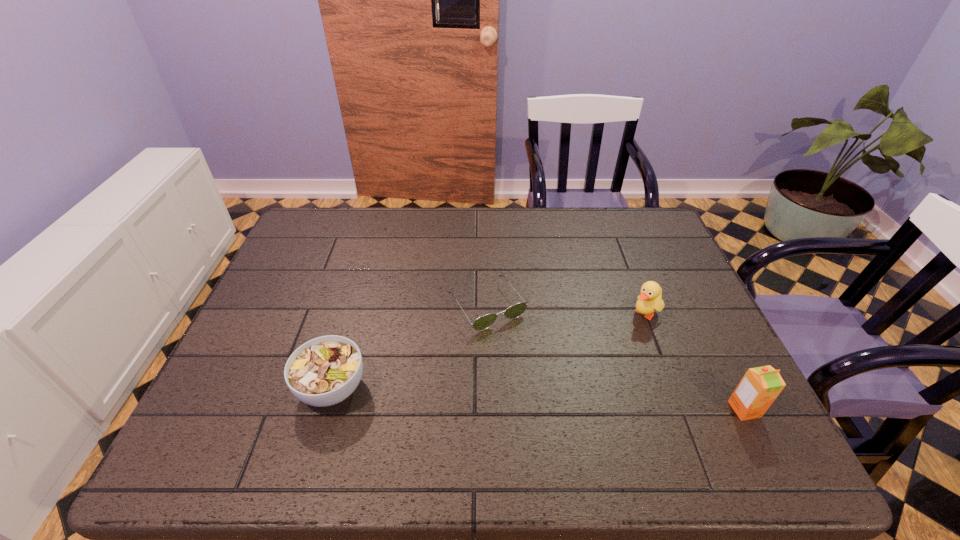
Locate an element on the screen. The width and height of the screenshot is (960, 540). soup bowl is located at coordinates (324, 371).

Locate an element on the screen. the leftmost object is located at coordinates (324, 371).

The image size is (960, 540). I want to click on orange juice, so click(760, 386).

Image resolution: width=960 pixels, height=540 pixels. Find the location of `the tallest object`. the tallest object is located at coordinates (760, 386).

At what (x,y) coordinates should I click in order to perform the action: click on duckling. Please return your answer as a coordinate pair (x, y). This screenshot has height=540, width=960. Looking at the image, I should click on (650, 299).

This screenshot has height=540, width=960. What are the coordinates of `the second tallest object` in the screenshot? It's located at (650, 299).

The height and width of the screenshot is (540, 960). I want to click on the shortest object, so click(484, 322).

Locate an element on the screen. sunglasses is located at coordinates point(484,322).

The image size is (960, 540). Find the location of `vacant position located 0.170m on the right of the leftmost object`. vacant position located 0.170m on the right of the leftmost object is located at coordinates (444, 388).

The width and height of the screenshot is (960, 540). I want to click on free space located 0.350m on the back of the tallest object, so click(x=684, y=288).